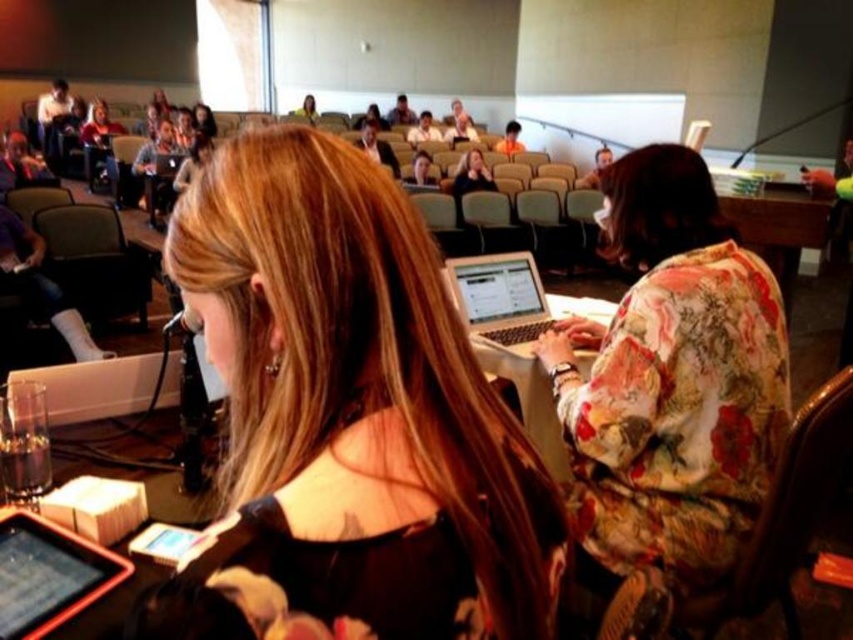
Question: Which of the following is the closest to the observer?

Choices:
 (A) [x=403, y=122]
 (B) [x=780, y=550]
 (C) [x=506, y=304]
 (D) [x=465, y=186]

Answer: (B)

Question: Can you confirm if matte black laptop at center is positioned to the right of matte black laptop at upper center?

Choices:
 (A) yes
 (B) no

Answer: (A)

Question: Is the position of wooden chair at center less distant than that of matte black laptop at center?

Choices:
 (A) no
 (B) yes

Answer: (B)

Question: Is wooden chair at center to the left of orange shirt at upper center from the viewer's perspective?

Choices:
 (A) no
 (B) yes

Answer: (B)

Question: Which of these objects is positioned farthest from the white glossy shirt at center?

Choices:
 (A) matte black laptop at center
 (B) shiny black hair at center
 (C) matte gray chair at left

Answer: (B)

Question: Which point appears farthest from the camera in this image?

Choices:
 (A) (752, 449)
 (B) (494, 292)
 (C) (310, 440)
 (D) (70, 259)

Answer: (D)